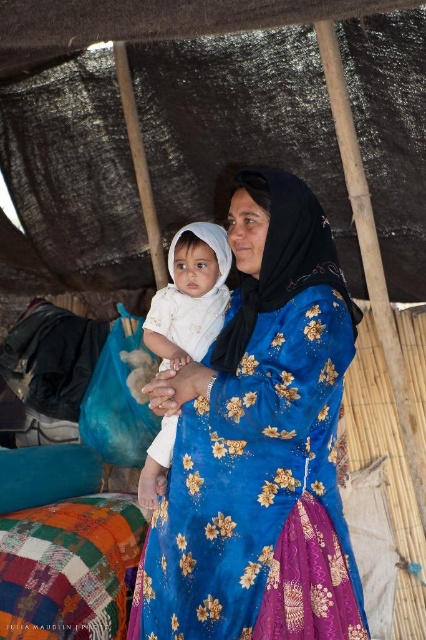
Does blue satin dress at center lie behind white cloth at center?

No, it is not.

Is point (195, 589) closer to viewer compared to point (190, 243)?

Yes, it is in front of point (190, 243).

Where is `blue satin dress at center`? blue satin dress at center is located at coordinates (258, 493).